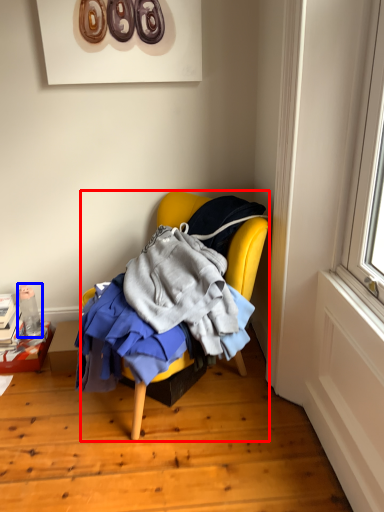
Question: Which of the following is the farthest to the observer, chair (highlighted by a red box) or bottle (highlighted by a blue box)?

Choices:
 (A) chair
 (B) bottle

Answer: (B)